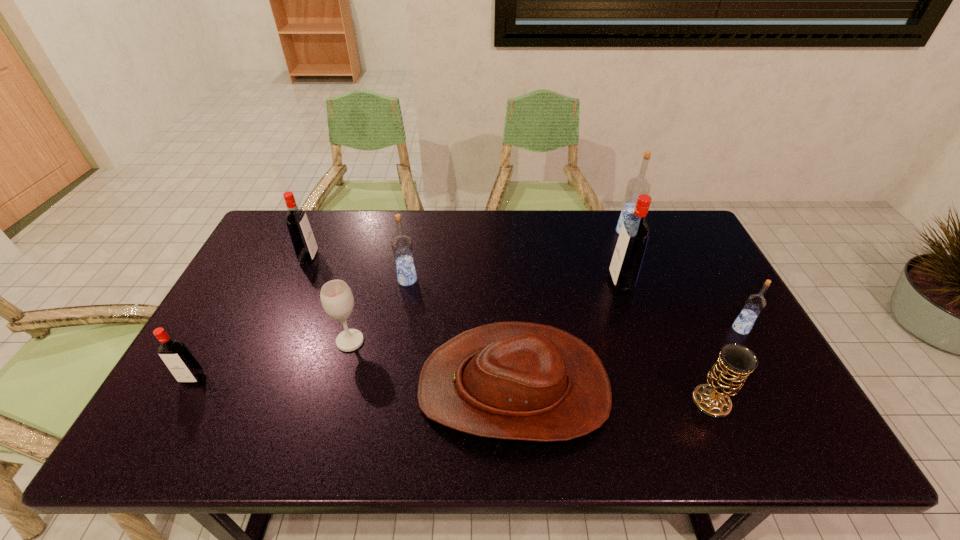
You are a GUI agent. You are given a task and a screenshot of the screen. Output one action in this format:
    pyautogui.click(x=<x>, y=<y>)
    Task: Click on the leftmost red vodka
    
    Given the screenshot: What is the action you would take?
    pyautogui.click(x=185, y=368)

Locate an element on the screen. The image size is (960, 540). the rightmost blue vodka is located at coordinates (755, 303).

The height and width of the screenshot is (540, 960). I want to click on the rightmost vodka, so click(755, 303).

Find the location of a particular element. The image size is (960, 540). chalice is located at coordinates (726, 377).

Image resolution: width=960 pixels, height=540 pixels. In order to click on brown cowboy hat in this screenshot , I will do `click(514, 380)`.

The image size is (960, 540). Identify the location of the fifth object from left to right. (514, 380).

Locate an element on the screen. The height and width of the screenshot is (540, 960). free spot located 0.370m on the left of the biggest blue vodka is located at coordinates (509, 232).

Locate an element on the screen. vacant position located 0.140m on the front and back of the sixth object from left to right is located at coordinates (564, 282).

Identify the location of free point located 0.140m on the front and back of the sixth object from left to right. The width and height of the screenshot is (960, 540). (564, 282).

The width and height of the screenshot is (960, 540). Identify the location of vacant area located 0.330m on the front and back of the sixth object from left to right. (501, 282).